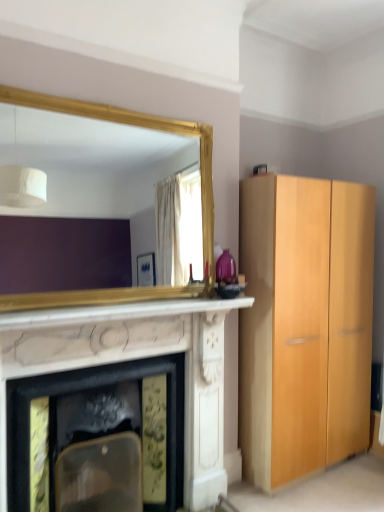
Question: From a real-world perspective, is white marble fireplace at center over gold-framed mirror at upper left?

Choices:
 (A) no
 (B) yes

Answer: (A)

Question: Is white marble fireplace at center surrounding gold-framed mirror at upper left?

Choices:
 (A) no
 (B) yes

Answer: (A)

Question: Does white marble fireplace at center have a greater height compared to gold-framed mirror at upper left?

Choices:
 (A) no
 (B) yes

Answer: (B)

Question: Does white marble fireplace at center appear on the right side of gold-framed mirror at upper left?

Choices:
 (A) yes
 (B) no

Answer: (B)

Question: From the image's perspective, is white marble fireplace at center on top of gold-framed mirror at upper left?

Choices:
 (A) yes
 (B) no

Answer: (B)

Question: Is white marble fireplace at center wider than gold-framed mirror at upper left?

Choices:
 (A) no
 (B) yes

Answer: (B)

Question: From the image's perspective, does white marble fireplace at center appear lower than gold-framed mirror at upper left?

Choices:
 (A) no
 (B) yes

Answer: (B)

Question: From a real-world perspective, is white marble fireplace at center located higher than gold-framed mirror at upper left?

Choices:
 (A) yes
 (B) no

Answer: (B)

Question: Does white marble fireplace at center touch gold-framed mirror at upper left?

Choices:
 (A) yes
 (B) no

Answer: (B)

Question: Is white marble fireplace at center to the right of gold-framed mirror at upper left from the viewer's perspective?

Choices:
 (A) yes
 (B) no

Answer: (A)

Question: From the image's perspective, is white marble fireplace at center over gold-framed mirror at upper left?

Choices:
 (A) yes
 (B) no

Answer: (B)

Question: Is white marble fireplace at center further to camera compared to gold-framed mirror at upper left?

Choices:
 (A) no
 (B) yes

Answer: (A)

Question: From a real-world perspective, is white marble fireplace at center beneath white marble fireplace at center?

Choices:
 (A) yes
 (B) no

Answer: (B)